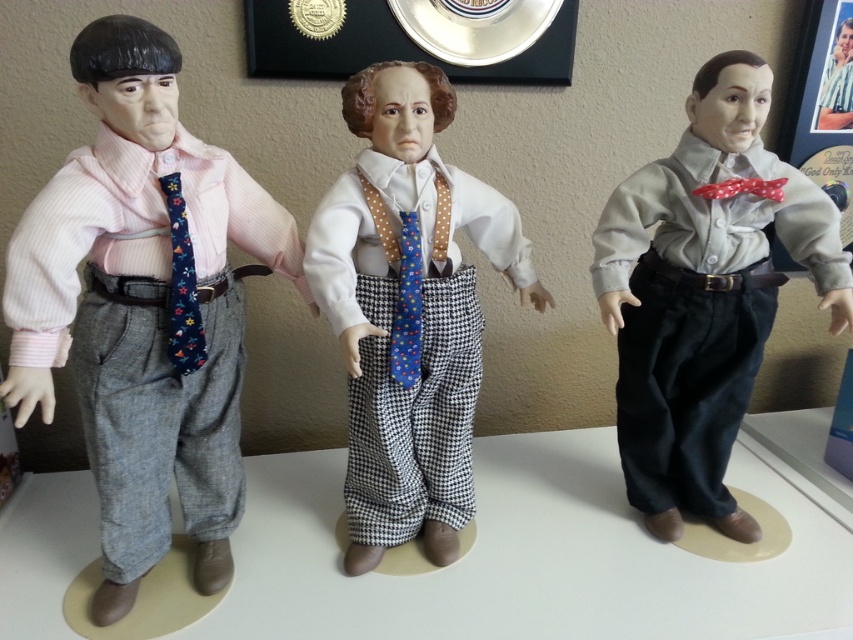
You are a delivery person who needs to place a small package between the matte pink shirt at left and the matte gray shirt at center. The package is 24 inches long. Will it fit between them without overlapping either?

The distance between the matte pink shirt at left and the matte gray shirt at center is 24.36 inches. Since the package is 24 inches long, it will fit between them without overlapping.

In the scene with three vintage dressed figurines on a white surface, you need to determine which object among the matte gray shirt at center and the polka dot fabric tie at center is taller. Which one is taller?

The matte gray shirt at center is taller than the polka dot fabric tie at center.